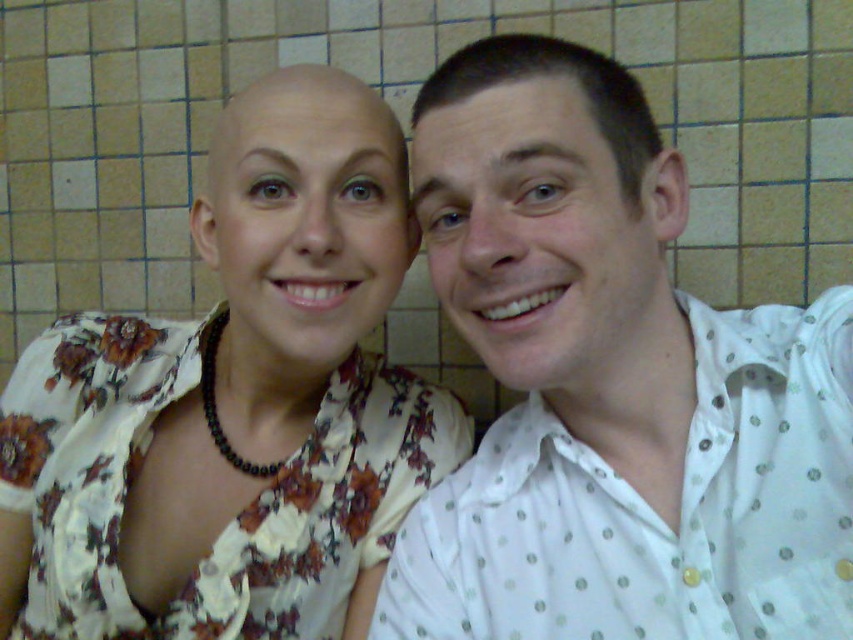
Question: Does white dotted shirt at upper right have a smaller size compared to floral fabric dress at center?

Choices:
 (A) yes
 (B) no

Answer: (A)

Question: Among these objects, which one is farthest from the camera?

Choices:
 (A) floral fabric dress at center
 (B) white dotted shirt at upper right

Answer: (A)

Question: Based on their relative distances, which object is farther from the white dotted shirt at upper right?

Choices:
 (A) beige tile at center
 (B) floral fabric dress at center

Answer: (A)

Question: Considering the real-world distances, which object is farthest from the floral fabric dress at center?

Choices:
 (A) beige tile at center
 (B) white dotted shirt at upper right

Answer: (A)

Question: Can you confirm if white dotted shirt at upper right is bigger than beige tile at center?

Choices:
 (A) no
 (B) yes

Answer: (A)

Question: Is white dotted shirt at upper right below beige tile at center?

Choices:
 (A) yes
 (B) no

Answer: (A)